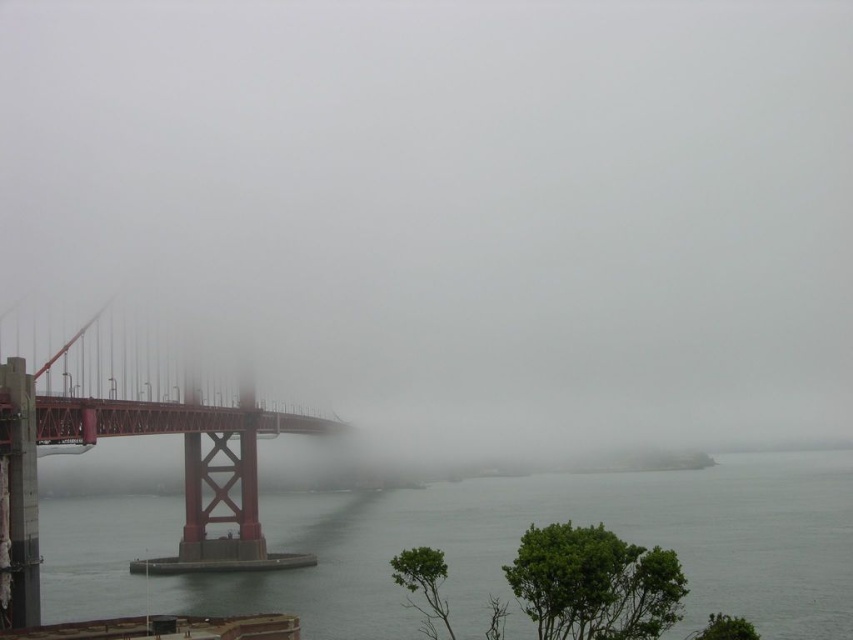
You are a photographer trying to capture the matte red suspension bridge at left in the foreground. However, the clear water at lower left is blocking part of the view. Which object should you move closer to in order to frame the bridge better?

To frame the matte red suspension bridge at left better, you should move closer to the clear water at lower left since it is taller than the bridge and might be obscuring the view. By moving closer to the water, you can adjust your angle to reduce its height in the frame, allowing the bridge to take center stage.

Based on the photo, you are standing on the Golden Gate Bridge and looking at two points marked on the bridge. The first point is at coordinates point (x=376, y=632) and the second is at point (x=207, y=488). Which point is closer to you?

Point (x=376, y=632) is closer to the viewer than point (x=207, y=488).